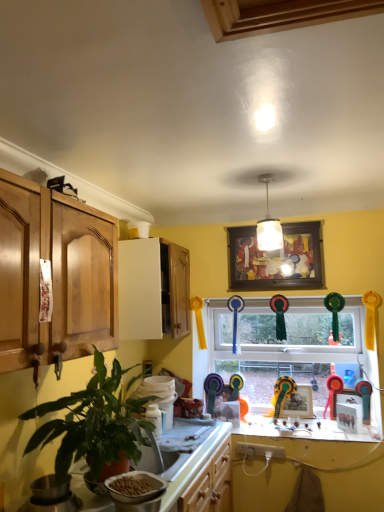
The height and width of the screenshot is (512, 384). In order to click on free space in front of matte wooden picture frame at center, which appears as the 2th picture frame when viewed from the front in this screenshot , I will do `click(296, 426)`.